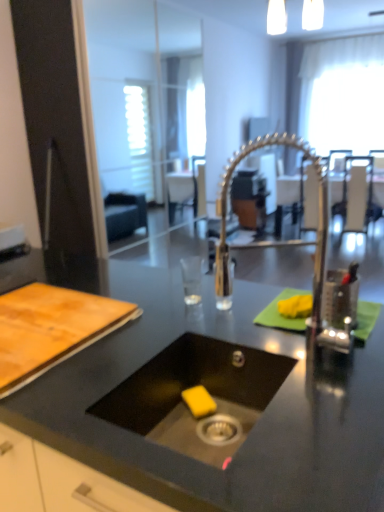
Question: In the image, is black matte sink at center on the left side or the right side of metallic silver table at center?

Choices:
 (A) right
 (B) left

Answer: (B)

Question: Would you say black matte sink at center is inside or outside metallic silver table at center?

Choices:
 (A) outside
 (B) inside

Answer: (A)

Question: Based on their relative distances, which object is nearer to the white sheer curtain at upper right?

Choices:
 (A) black matte sink at center
 (B) black matte countertop at center
 (C) metallic silver chair at upper center, the 2th chair positioned from the right
 (D) metallic silver table at center
 (E) metallic silver chair at center, the third chair from the right

Answer: (E)

Question: Estimate the real-world distances between objects in this image. Which object is closer to the black matte sink at center?

Choices:
 (A) polished metallic faucet at center
 (B) metallic silver chair at upper right, the 1th chair viewed from the right
 (C) wooden cutting board at left
 (D) metallic silver chair at upper center, which is counted as the second chair, starting from the left
 (E) black matte countertop at center

Answer: (E)